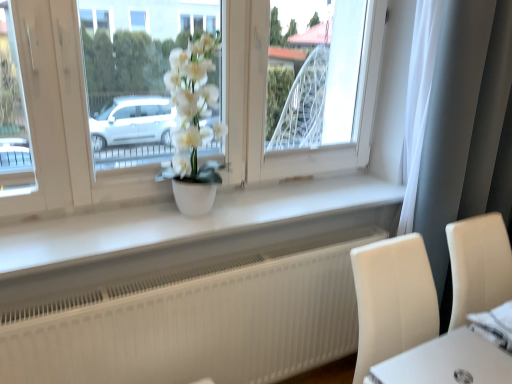
At what (x,y) coordinates should I click in order to perform the action: click on blank area beneath white matte pot at center (from a real-world perspective). Please return your answer as a coordinate pair (x, y). The image size is (512, 384). Looking at the image, I should click on (194, 218).